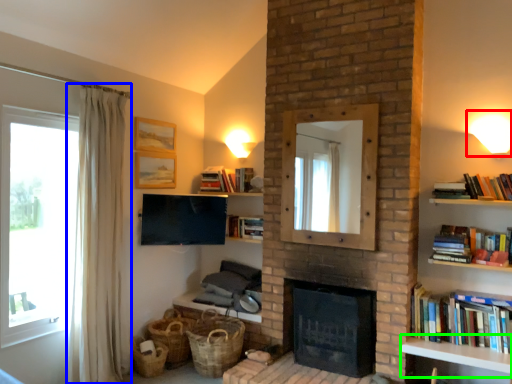
Question: Which object is positioned farthest from light fixture (highlighted by a red box)? Select from curtain (highlighted by a blue box) and table (highlighted by a green box).

Choices:
 (A) curtain
 (B) table

Answer: (A)